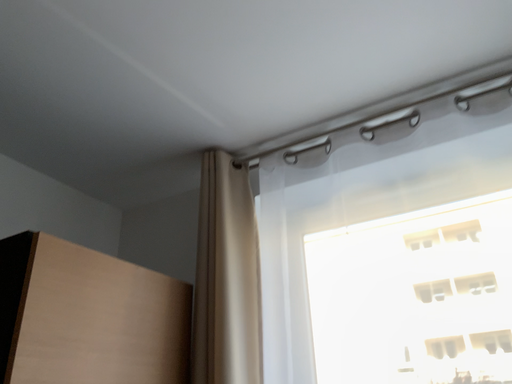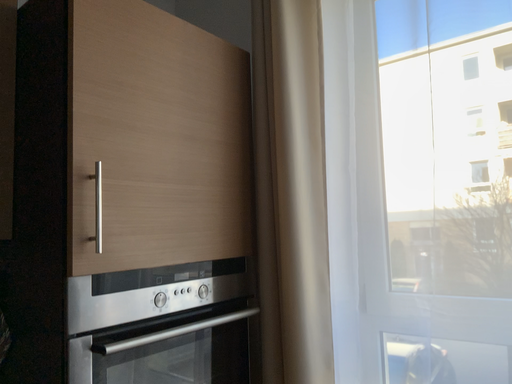
Question: How did the camera likely rotate when shooting the video?

Choices:
 (A) rotated right
 (B) rotated left

Answer: (B)